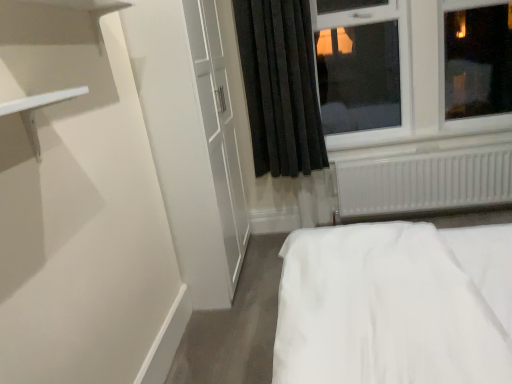
Question: Considering the relative positions of black velvet curtain at upper center and white plastic radiator at lower right in the image provided, is black velvet curtain at upper center to the right of white plastic radiator at lower right from the viewer's perspective?

Choices:
 (A) no
 (B) yes

Answer: (A)

Question: Is black velvet curtain at upper center thinner than white plastic radiator at lower right?

Choices:
 (A) no
 (B) yes

Answer: (A)

Question: Can you confirm if black velvet curtain at upper center is smaller than white plastic radiator at lower right?

Choices:
 (A) yes
 (B) no

Answer: (B)

Question: Is black velvet curtain at upper center not near white plastic radiator at lower right?

Choices:
 (A) no
 (B) yes

Answer: (A)

Question: Is black velvet curtain at upper center positioned beyond the bounds of white plastic radiator at lower right?

Choices:
 (A) yes
 (B) no

Answer: (A)

Question: Is black velvet curtain at upper center bigger or smaller than white plastic radiator at lower right?

Choices:
 (A) small
 (B) big

Answer: (B)

Question: From the image's perspective, is black velvet curtain at upper center located above or below white plastic radiator at lower right?

Choices:
 (A) above
 (B) below

Answer: (A)

Question: Is point (288, 79) closer or farther from the camera than point (391, 157)?

Choices:
 (A) closer
 (B) farther

Answer: (A)

Question: Relative to white plastic radiator at lower right, is black velvet curtain at upper center in front or behind?

Choices:
 (A) behind
 (B) front

Answer: (B)

Question: Does point (450, 44) appear closer or farther from the camera than point (270, 61)?

Choices:
 (A) farther
 (B) closer

Answer: (A)

Question: From a real-world perspective, is white plastic window at upper right physically located above or below black velvet curtain at upper center?

Choices:
 (A) above
 (B) below

Answer: (A)

Question: From the image's perspective, is white plastic window at upper right located above or below black velvet curtain at upper center?

Choices:
 (A) above
 (B) below

Answer: (A)

Question: Looking at their shapes, would you say white plastic window at upper right is wider or thinner than black velvet curtain at upper center?

Choices:
 (A) wide
 (B) thin

Answer: (A)

Question: Based on their sizes in the image, would you say white plastic radiator at lower right is bigger or smaller than white plastic window at upper right?

Choices:
 (A) small
 (B) big

Answer: (A)

Question: From the image's perspective, is white plastic radiator at lower right located above or below white plastic window at upper right?

Choices:
 (A) below
 (B) above

Answer: (A)